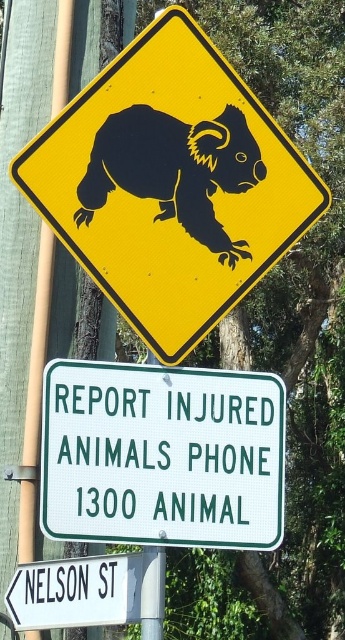
Question: Which of the following is the closest to the observer?

Choices:
 (A) (262, 481)
 (B) (120, 301)
 (C) (95, 563)

Answer: (A)

Question: Can you confirm if black matte koala at center is bigger than white plastic street sign at lower left?

Choices:
 (A) no
 (B) yes

Answer: (A)

Question: Which point is closer to the camera taking this photo?

Choices:
 (A) (142, 326)
 (B) (249, 141)
 (C) (182, 452)
 (D) (136, 595)

Answer: (C)

Question: Is green metal sign at center wider than white plastic street sign at lower left?

Choices:
 (A) no
 (B) yes

Answer: (B)

Question: Observing the image, what is the correct spatial positioning of black plastic koala at upper center in reference to black matte koala at center?

Choices:
 (A) above
 (B) below

Answer: (A)

Question: Estimate the real-world distances between objects in this image. Which object is closer to the white plastic street sign at lower left?

Choices:
 (A) black plastic koala at upper center
 (B) green metal sign at center

Answer: (B)